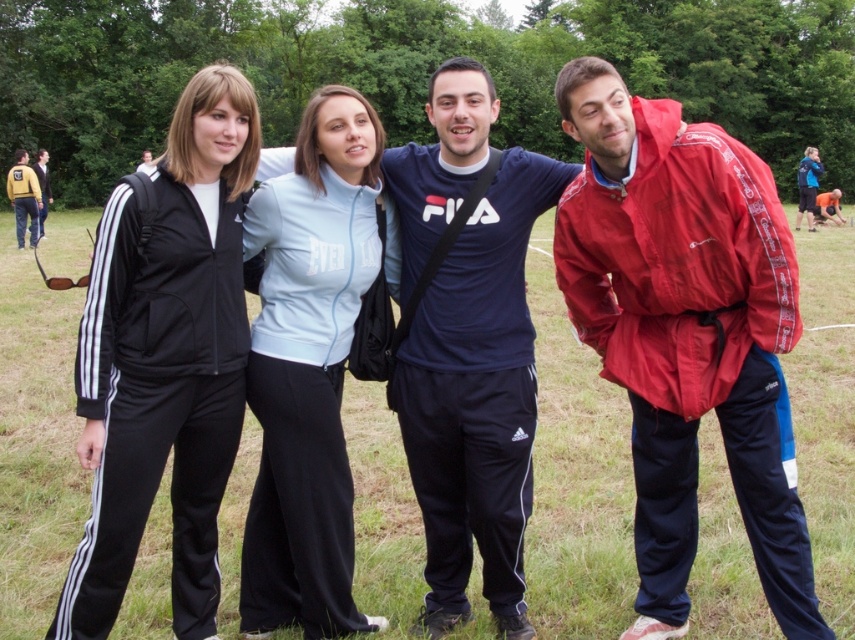
In the scene described, there are two people wearing the orange fabric shirt at right and the matte black jacket at center. Which of these two items of clothing takes up more visual space in the image?

The matte black jacket at center occupies more visual space than the orange fabric shirt at right.

You are organizing a group photo and need to arrange the black matte tracksuit at center and the yellow leather jacket at left so that they are side by side. Which person should stand on the left side to ensure the total width is minimized?

The yellow leather jacket at left should stand on the left side because if the black matte tracksuit at center is wider, placing the narrower one first would minimize the total width.